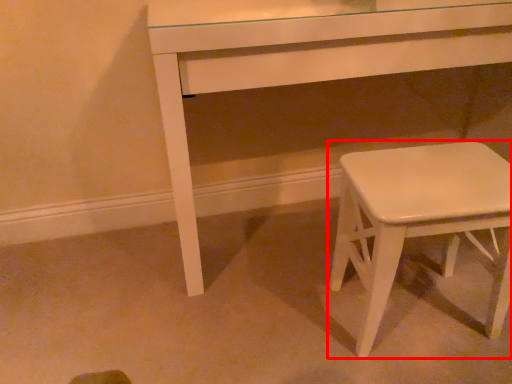
Question: From the image's perspective, where is stool (annotated by the red box) located relative to table?

Choices:
 (A) above
 (B) below

Answer: (B)